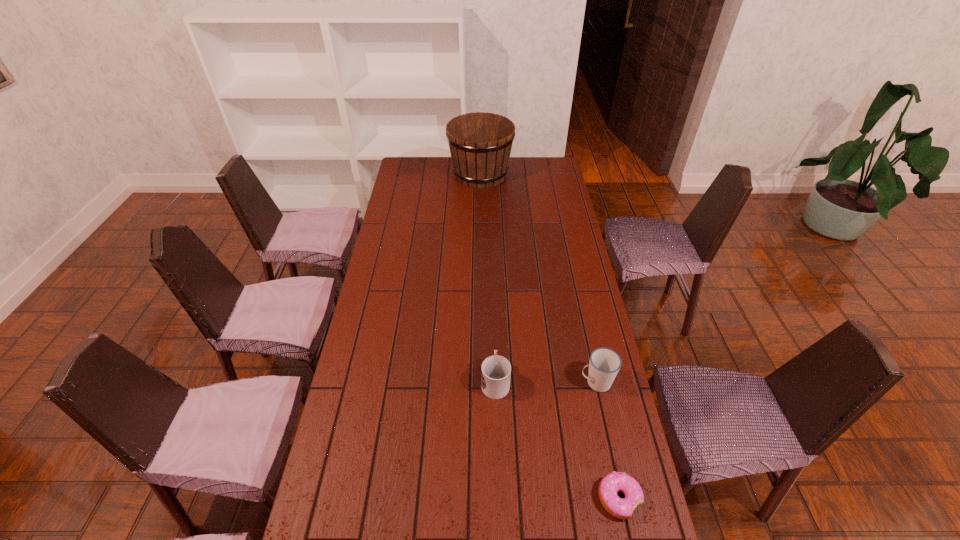
I want to click on free space located 0.260m with a handle on the side of the right cup, so click(497, 382).

I want to click on vacant region located 0.280m on the handle side of the left cup, so click(493, 302).

Find the location of a particular element. vacant space positioned on the handle side of the left cup is located at coordinates (492, 287).

The width and height of the screenshot is (960, 540). What are the coordinates of `vacant space located on the handle side of the left cup` in the screenshot? It's located at (493, 327).

Where is `free space located 0.130m on the left of the nearest object`? The image size is (960, 540). free space located 0.130m on the left of the nearest object is located at coordinates (547, 498).

The width and height of the screenshot is (960, 540). Find the location of `object located at the far edge`. object located at the far edge is located at coordinates (480, 143).

Locate an element on the screen. This screenshot has width=960, height=540. cup that is at the right edge is located at coordinates (604, 364).

Identify the location of doughnut that is at the right edge. (611, 484).

Image resolution: width=960 pixels, height=540 pixels. In order to click on vacant space at the left edge of the desktop in this screenshot , I will do `click(368, 347)`.

The height and width of the screenshot is (540, 960). In the image, there is a desktop. In order to click on free space at the right edge in this screenshot , I will do `click(540, 218)`.